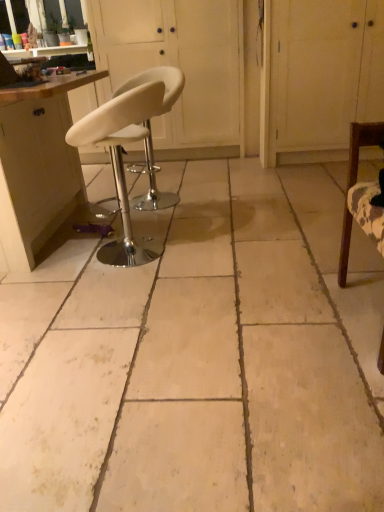
Identify the location of vacant area on the back side of white leather stool at center, which is counted as the 2th chair, starting from the right. (180, 179).